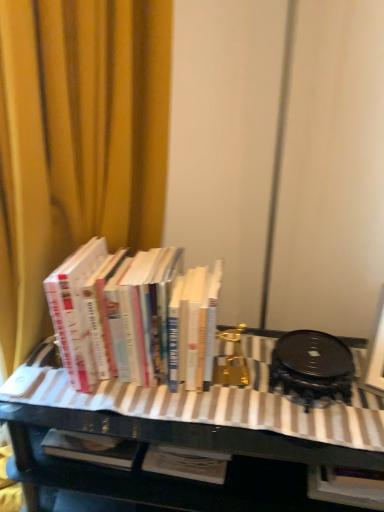
Question: Is hardcover books at left bigger than black glossy table at center?

Choices:
 (A) yes
 (B) no

Answer: (B)

Question: Is hardcover books at left looking in the opposite direction of black glossy table at center?

Choices:
 (A) yes
 (B) no

Answer: (B)

Question: Is hardcover books at left next to black glossy table at center?

Choices:
 (A) no
 (B) yes

Answer: (A)

Question: From the image's perspective, would you say hardcover books at left is shown under black glossy table at center?

Choices:
 (A) yes
 (B) no

Answer: (B)

Question: Is black glossy table at center completely or partially inside hardcover books at left?

Choices:
 (A) yes
 (B) no

Answer: (B)

Question: From the image's perspective, is black glossy table at center positioned above or below yellow fabric curtain at upper left?

Choices:
 (A) above
 (B) below

Answer: (B)

Question: From a real-world perspective, is black glossy table at center physically located above or below yellow fabric curtain at upper left?

Choices:
 (A) above
 (B) below

Answer: (B)

Question: Considering their positions, is black glossy table at center located in front of or behind yellow fabric curtain at upper left?

Choices:
 (A) front
 (B) behind

Answer: (B)

Question: Looking at their shapes, would you say black glossy table at center is wider or thinner than yellow fabric curtain at upper left?

Choices:
 (A) wide
 (B) thin

Answer: (A)

Question: In the image, is hardcover books at left positioned in front of or behind yellow fabric curtain at upper left?

Choices:
 (A) behind
 (B) front

Answer: (A)

Question: Does point (57, 282) appear closer or farther from the camera than point (100, 125)?

Choices:
 (A) farther
 (B) closer

Answer: (B)

Question: From a real-world perspective, is hardcover books at left above or below yellow fabric curtain at upper left?

Choices:
 (A) below
 (B) above

Answer: (A)

Question: From their relative heights in the image, would you say hardcover books at left is taller or shorter than yellow fabric curtain at upper left?

Choices:
 (A) short
 (B) tall

Answer: (A)

Question: Does point (134, 423) appear closer or farther from the camera than point (69, 310)?

Choices:
 (A) closer
 (B) farther

Answer: (B)

Question: In terms of size, does black glossy table at center appear bigger or smaller than hardcover books at left?

Choices:
 (A) small
 (B) big

Answer: (B)